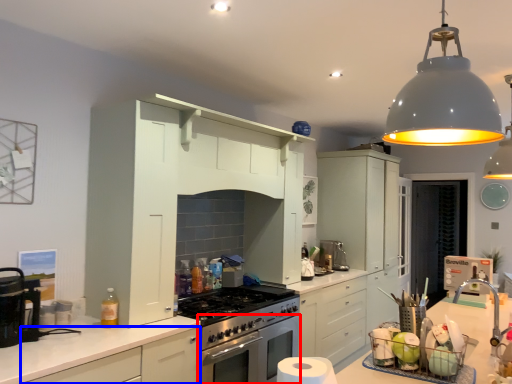
Question: Among these objects, which one is nearest to the camera, oven (highlighted by a red box) or cabinetry (highlighted by a blue box)?

Choices:
 (A) oven
 (B) cabinetry

Answer: (B)